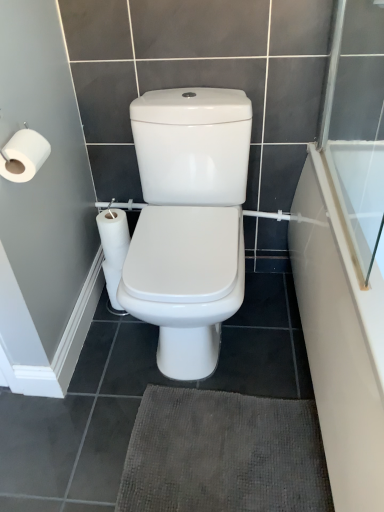
Image resolution: width=384 pixels, height=512 pixels. I want to click on free point above dark gray textured bath mat at lower center (from a real-world perspective), so click(x=225, y=452).